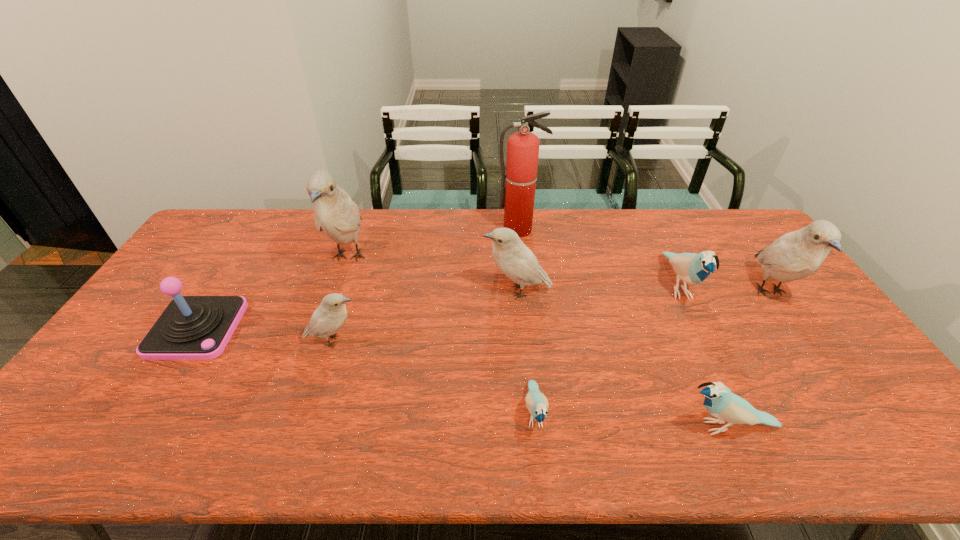
Identify the location of the tallest object. (518, 192).

Find the location of `red fire extinguisher`. red fire extinguisher is located at coordinates (518, 192).

Where is `the biggest white bird`? The width and height of the screenshot is (960, 540). the biggest white bird is located at coordinates (335, 214).

The image size is (960, 540). Find the location of `the tallest bird`. the tallest bird is located at coordinates (335, 214).

Image resolution: width=960 pixels, height=540 pixels. I want to click on the sixth shortest bird, so click(x=796, y=255).

Locate an element on the screen. The height and width of the screenshot is (540, 960). the seventh shortest object is located at coordinates (796, 255).

At what (x,y) coordinates should I click in order to perform the action: click on the third biggest white bird. Please return your answer as a coordinate pair (x, y). Looking at the image, I should click on (510, 254).

In order to click on the biggest blue bird in this screenshot , I will do `click(693, 268)`.

You are a GUI agent. You are given a task and a screenshot of the screen. Output one action in this format:
    pyautogui.click(x=<x>, y=<y>)
    Task: Click on the joystick
    The height and width of the screenshot is (540, 960).
    Given the screenshot: What is the action you would take?
    pyautogui.click(x=191, y=327)

The height and width of the screenshot is (540, 960). In order to click on pink joystick in this screenshot , I will do `click(191, 327)`.